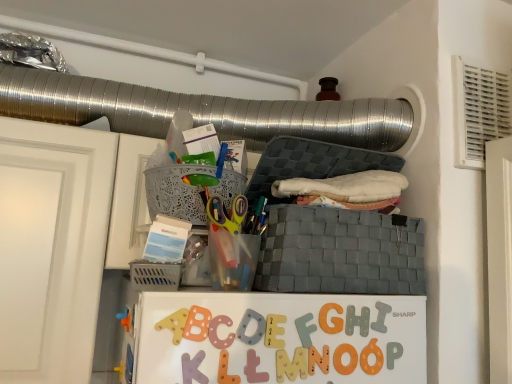
Question: Can you confirm if matte plastic letter l at center, the sixth alphabet positioned from the right, is wider than wooden letter n at center, which ranks as the 5th alphabet in left-to-right order?

Choices:
 (A) yes
 (B) no

Answer: (B)

Question: Does matte plastic letter l at center, positioned as the 1th alphabet in left-to-right order, have a greater height compared to wooden letter n at center, which ranks as the second alphabet in right-to-left order?

Choices:
 (A) no
 (B) yes

Answer: (B)

Question: Is matte plastic letter l at center, positioned as the 1th alphabet in left-to-right order, positioned in front of wooden letter n at center, which ranks as the 5th alphabet in left-to-right order?

Choices:
 (A) yes
 (B) no

Answer: (A)

Question: Does matte plastic letter l at center, positioned as the 1th alphabet in left-to-right order, have a larger size compared to wooden letter n at center, which ranks as the second alphabet in right-to-left order?

Choices:
 (A) no
 (B) yes

Answer: (A)

Question: From a real-world perspective, does matte plastic letter l at center, positioned as the 1th alphabet in left-to-right order, stand above wooden letter n at center, which ranks as the 5th alphabet in left-to-right order?

Choices:
 (A) yes
 (B) no

Answer: (B)

Question: Is matte plastic letter l at center, positioned as the 1th alphabet in left-to-right order, to the left of wooden letter n at center, which ranks as the second alphabet in right-to-left order, from the viewer's perspective?

Choices:
 (A) yes
 (B) no

Answer: (A)

Question: Is gray matte letter i at center, the 6th alphabet in the left-to-right sequence, to the left of matte plastic letter m at center, acting as the 3th alphabet starting from the left, from the viewer's perspective?

Choices:
 (A) yes
 (B) no

Answer: (B)

Question: Can you confirm if gray matte letter i at center, placed as the first alphabet when sorted from right to left, is bigger than matte plastic letter m at center, arranged as the fourth alphabet when viewed from the right?

Choices:
 (A) no
 (B) yes

Answer: (B)

Question: Can you confirm if gray matte letter i at center, the 6th alphabet in the left-to-right sequence, is thinner than matte plastic letter m at center, arranged as the fourth alphabet when viewed from the right?

Choices:
 (A) yes
 (B) no

Answer: (B)

Question: Considering the relative sizes of gray matte letter i at center, placed as the first alphabet when sorted from right to left, and matte plastic letter m at center, arranged as the fourth alphabet when viewed from the right, in the image provided, is gray matte letter i at center, placed as the first alphabet when sorted from right to left, smaller than matte plastic letter m at center, arranged as the fourth alphabet when viewed from the right,?

Choices:
 (A) yes
 (B) no

Answer: (B)

Question: Is the position of gray matte letter i at center, placed as the first alphabet when sorted from right to left, less distant than that of matte plastic letter m at center, arranged as the fourth alphabet when viewed from the right?

Choices:
 (A) yes
 (B) no

Answer: (B)

Question: Is gray matte letter i at center, placed as the first alphabet when sorted from right to left, not inside matte plastic letter m at center, arranged as the fourth alphabet when viewed from the right?

Choices:
 (A) yes
 (B) no

Answer: (A)

Question: Can you confirm if wooden letter n at center, which ranks as the 5th alphabet in left-to-right order, is bigger than gray woven basket at center, placed as the second basket when sorted from left to right?

Choices:
 (A) no
 (B) yes

Answer: (A)